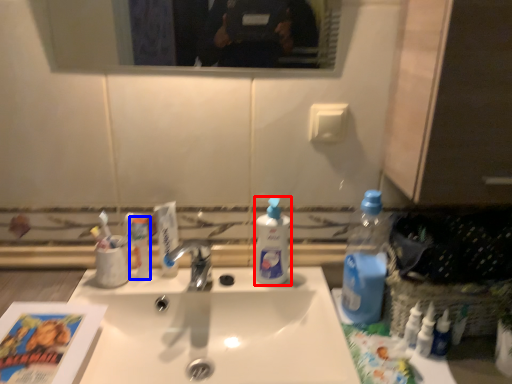
Question: Among these objects, which one is farthest to the camera, cleaning product (highlighted by a red box) or toiletry (highlighted by a blue box)?

Choices:
 (A) cleaning product
 (B) toiletry

Answer: (B)